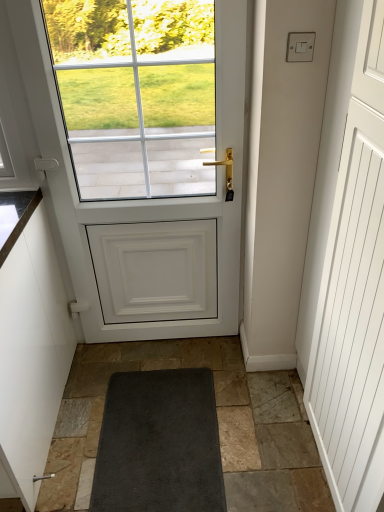
This screenshot has height=512, width=384. Describe the element at coordinates (43, 477) in the screenshot. I see `silver metallic door handle at lower left` at that location.

Find the location of a particular element. The image size is (384, 512). white plastic switch at upper right is located at coordinates (300, 46).

What is the approximate height of white plastic switch at upper right?

white plastic switch at upper right is 3.33 inches in height.

Find the location of a particular element. The image size is (384, 512). silver metallic door handle at lower left is located at coordinates (43, 477).

Is white matte cabinet at left positioned with its back to white matte screen door at right?

white matte cabinet at left does not have its back to white matte screen door at right.

This screenshot has width=384, height=512. What are the coordinates of `screen door above the white matte cabinet at left (from a real-world perspective)` in the screenshot? It's located at (348, 267).

Which object is more forward, white matte cabinet at left or white matte screen door at right?

white matte screen door at right.

Is there a large distance between white matte cabinet at left and white matte screen door at right?

That's right, there is a large distance between white matte cabinet at left and white matte screen door at right.

Looking at this image, is white matte door at center closer to camera compared to silver metallic door handle at lower left?

Yes.

From a real-world perspective, who is located higher, white matte door at center or silver metallic door handle at lower left?

From a 3D spatial view, white matte door at center is above.

Is white matte door at center in contact with silver metallic door handle at lower left?

No, white matte door at center is not making contact with silver metallic door handle at lower left.

Considering the sizes of white matte door at center and silver metallic door handle at lower left in the image, is white matte door at center bigger or smaller than silver metallic door handle at lower left?

Considering their sizes, white matte door at center takes up more space than silver metallic door handle at lower left.

From their relative heights in the image, would you say white plastic switch at upper right is taller or shorter than white matte screen door at right?

white plastic switch at upper right is shorter than white matte screen door at right.

Consider the image. From a real-world perspective, is white plastic switch at upper right located beneath white matte screen door at right?

No, from a real-world perspective, white plastic switch at upper right is not beneath white matte screen door at right.

Is white plastic switch at upper right wider or thinner than white matte screen door at right?

white plastic switch at upper right is thinner than white matte screen door at right.

How distant is white plastic switch at upper right from white matte screen door at right?

A: white plastic switch at upper right and white matte screen door at right are 27.05 inches apart.

Is silver metallic door handle at lower left oriented towards white matte cabinet at left?

No, silver metallic door handle at lower left is not oriented towards white matte cabinet at left.

From their relative heights in the image, would you say silver metallic door handle at lower left is taller or shorter than white matte cabinet at left?

Considering their sizes, silver metallic door handle at lower left has less height than white matte cabinet at left.

What's the angular difference between silver metallic door handle at lower left and white matte cabinet at left's facing directions?

There is a 91.2-degree angle between the facing directions of silver metallic door handle at lower left and white matte cabinet at left.

Is white matte door at center far from white matte cabinet at left?

They are positioned close to each other.

Who is bigger, white matte door at center or white matte cabinet at left?

With larger size is white matte cabinet at left.

Is point (178, 180) in front of point (47, 298)?

That is False.

Can you confirm if white matte door at center is taller than white matte cabinet at left?

Yes, white matte door at center is taller than white matte cabinet at left.

From a real-world perspective, is white matte screen door at right positioned over white matte door at center based on gravity?

No, from a real-world perspective, white matte screen door at right is not over white matte door at center

Is point (326, 451) less distant than point (124, 82)?

Yes, point (326, 451) is in front of point (124, 82).

Can you confirm if white matte screen door at right is shorter than white matte door at center?

Correct, white matte screen door at right is not as tall as white matte door at center.

Would you consider white matte screen door at right to be distant from white matte door at center?

That's not correct — white matte screen door at right is a little close to white matte door at center.

Can you confirm if white matte door at center is taller than white matte screen door at right?

Correct, white matte door at center is much taller as white matte screen door at right.

Which object is positioned more to the left, white matte door at center or white matte screen door at right?

white matte door at center is more to the left.

From the image's perspective, would you say white matte door at center is positioned over white matte screen door at right?

Correct, white matte door at center appears higher than white matte screen door at right in the image.

Locate an element on the screen. cabinetry on the left of white matte screen door at right is located at coordinates (31, 357).

Identify the location of door positioned vertically above the silver metallic door handle at lower left (from a real-world perspective). This screenshot has height=512, width=384. (151, 179).

Looking at the image, which one is located further to white plastic switch at upper right, white matte screen door at right or white matte cabinet at left?

white matte cabinet at left is further to white plastic switch at upper right.

When comparing their distances from silver metallic door handle at lower left, does white matte door at center or white plastic switch at upper right seem further?

Based on the image, white plastic switch at upper right appears to be further to silver metallic door handle at lower left.

Which object lies further to the anchor point white matte cabinet at left, silver metallic door handle at lower left or white plastic switch at upper right?

The object further to white matte cabinet at left is white plastic switch at upper right.

Looking at the image, which one is located closer to white matte screen door at right, silver metallic door handle at lower left or white matte cabinet at left?

white matte cabinet at left is positioned closer to the anchor white matte screen door at right.

When comparing their distances from white matte cabinet at left, does white matte screen door at right or white matte door at center seem closer?

Based on the image, white matte door at center appears to be nearer to white matte cabinet at left.

Estimate the real-world distances between objects in this image. Which object is closer to white matte door at center, white matte cabinet at left or white plastic switch at upper right?

white matte cabinet at left is positioned closer to the anchor white matte door at center.

From the image, which object appears to be farther from white plastic switch at upper right, silver metallic door handle at lower left or white matte door at center?

silver metallic door handle at lower left lies further to white plastic switch at upper right than the other object.

Looking at the image, which one is located further to white matte cabinet at left, white plastic switch at upper right or silver metallic door handle at lower left?

white plastic switch at upper right is further to white matte cabinet at left.

The height and width of the screenshot is (512, 384). I want to click on door situated between white matte cabinet at left and white plastic switch at upper right from left to right, so click(x=151, y=179).

Locate an element on the screen. This screenshot has height=512, width=384. cabinetry between white plastic switch at upper right and silver metallic door handle at lower left in the vertical direction is located at coordinates (31, 357).

Locate an element on the screen. door handle located between white matte cabinet at left and white matte screen door at right in the left-right direction is located at coordinates (43, 477).

Identify the location of lock positioned between white matte screen door at right and white matte door at center from near to far. (300, 46).